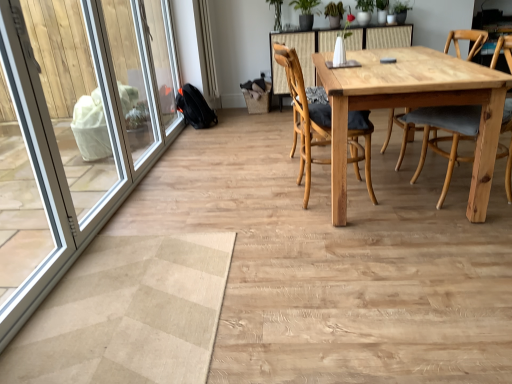
Identify the location of free point to the left of natural wood table at center. (220, 191).